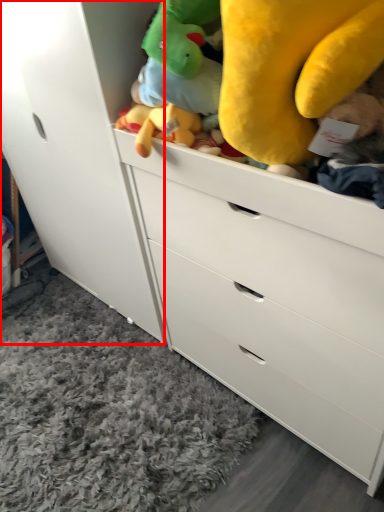
Question: Observing the image, what is the correct spatial positioning of cabinetry (annotated by the red box) in reference to plain?

Choices:
 (A) left
 (B) right

Answer: (B)